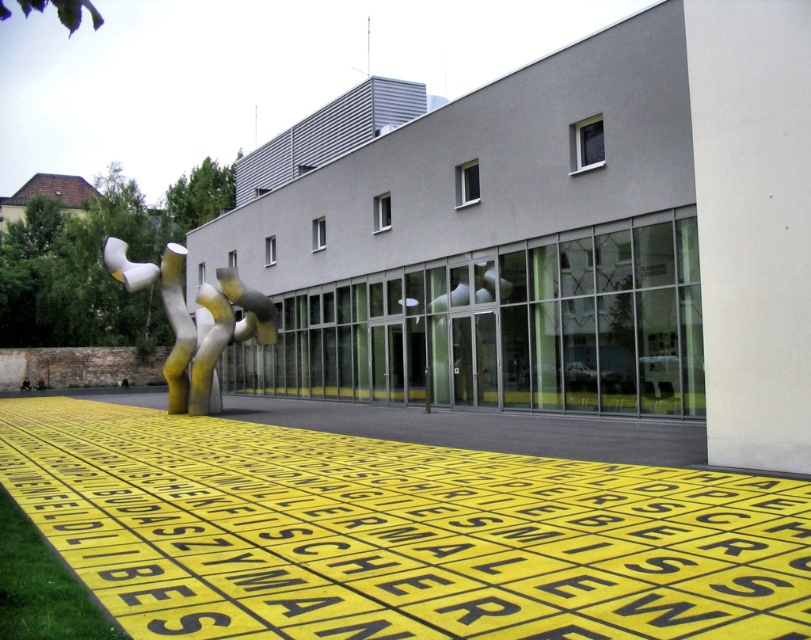
Who is positioned more to the left, polished stainless steel sculpture at center or polished white sculpture at center?

From the viewer's perspective, polished stainless steel sculpture at center appears more on the left side.

Is polished stainless steel sculpture at center below polished white sculpture at center?

No.

Is point (121, 259) positioned in front of point (440, 268)?

Yes, it is in front of point (440, 268).

You are a GUI agent. You are given a task and a screenshot of the screen. Output one action in this format:
    pyautogui.click(x=<x>, y=<y>)
    Task: Click on the polished stainless steel sculpture at center
    The height and width of the screenshot is (640, 811).
    Given the screenshot: What is the action you would take?
    pyautogui.click(x=195, y=321)

Who is more forward, [573,547] or [491,266]?

Positioned in front is point [573,547].

This screenshot has width=811, height=640. What do you see at coordinates (397, 532) in the screenshot?
I see `yellow plastic sign at lower center` at bounding box center [397, 532].

I want to click on yellow plastic sign at lower center, so click(x=397, y=532).

Who is more distant from viewer, (260, 451) or (196, 340)?

Positioned behind is point (196, 340).

Is point (286, 522) less distant than point (269, 332)?

Yes, point (286, 522) is closer to viewer.

Who is more distant from viewer, (0, 401) or (179, 321)?

The point (0, 401) is more distant.

Locate an element on the screen. The width and height of the screenshot is (811, 640). yellow plastic sign at lower center is located at coordinates (397, 532).